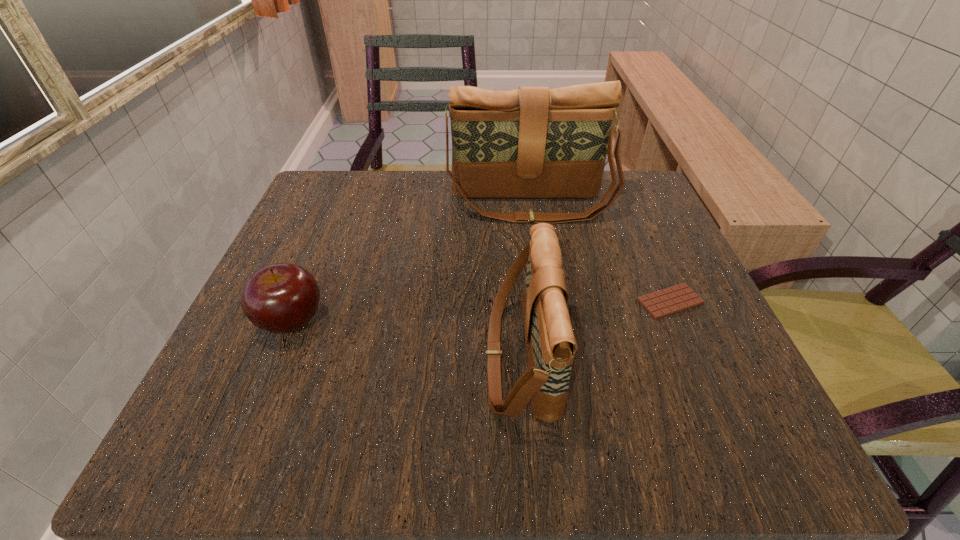
This screenshot has height=540, width=960. I want to click on empty space that is in between the taller shoulder bag and the leftmost object, so click(412, 263).

Image resolution: width=960 pixels, height=540 pixels. Find the location of `vacant point located between the farthest object and the candy bar`. vacant point located between the farthest object and the candy bar is located at coordinates (600, 253).

This screenshot has height=540, width=960. Identify the location of free point between the taller shoulder bag and the shortest object. (600, 253).

Where is `empty space that is in between the candy bar and the farthest object`? empty space that is in between the candy bar and the farthest object is located at coordinates (600, 253).

Identify which object is the nearest to the nearer shoulder bag. Please provide its 2D coordinates. Your answer should be formatted as a tuple, i.e. [(x, y)], where the tuple contains the x and y coordinates of a point satisfying the conditions above.

[(680, 297)]

Where is `object that is the closest to the leftmost object`? object that is the closest to the leftmost object is located at coordinates (550, 343).

Image resolution: width=960 pixels, height=540 pixels. I want to click on vacant space that satisfies the following two spatial constraints: 1. on the front-facing side of the candy bar; 2. on the right side of the taller shoulder bag, so click(x=545, y=301).

Identify the location of blank space that satisfies the following two spatial constraints: 1. on the front-facing side of the candy bar; 2. on the left side of the taller shoulder bag. The image size is (960, 540). (545, 301).